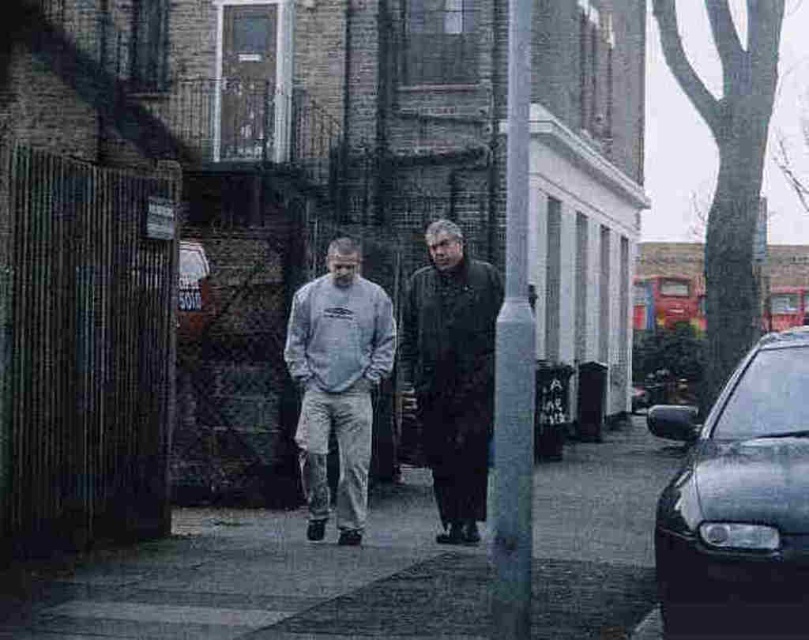
You are a delivery person who needs to park your shiny black car at right as close as possible to the gray cotton sweatshirt at center. According to the scene, what is the minimum distance you can get between them?

The minimum distance between the shiny black car at right and the gray cotton sweatshirt at center is 9.32 feet, so you cannot get closer than that.

You are a pedestrian standing at the edge of the sidewalk. You see a shiny black car at right and a gray cotton sweatshirt at center. Which object is nearer to you?

The shiny black car at right is closer to the viewer than the gray cotton sweatshirt at center, so the shiny black car at right is nearer to you.

You are standing at the point marked as point (805, 326) in the urban street scene. You want to take a photo of the two people walking on the sidewalk. Will you be able to capture them clearly in your photo if your camera has a maximum focus range of 7 meters?

The distance of point (805, 326) from viewer is 7.46 meters. Since the camera can only focus up to 7 meters, the subjects at 7.46 meters will be out of focus and not captured clearly.